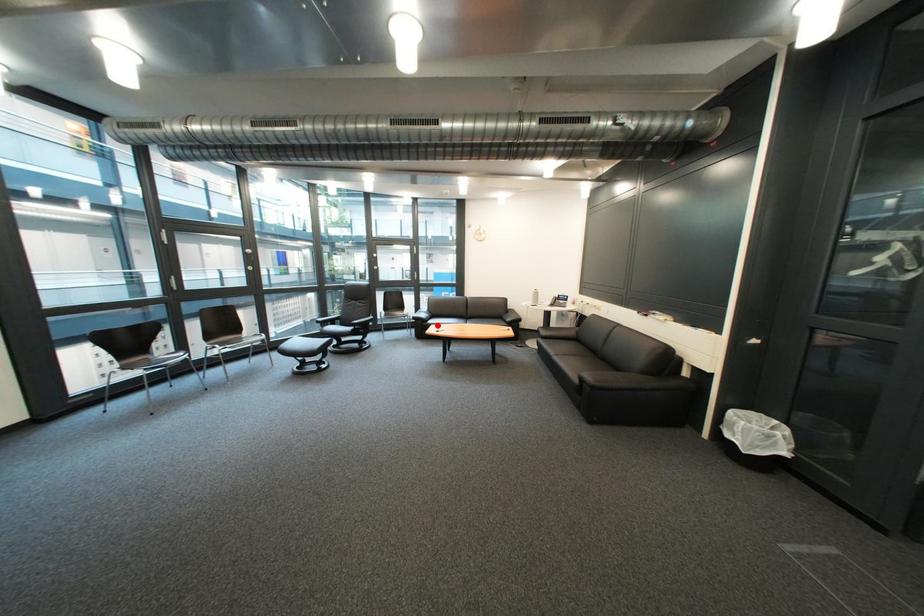
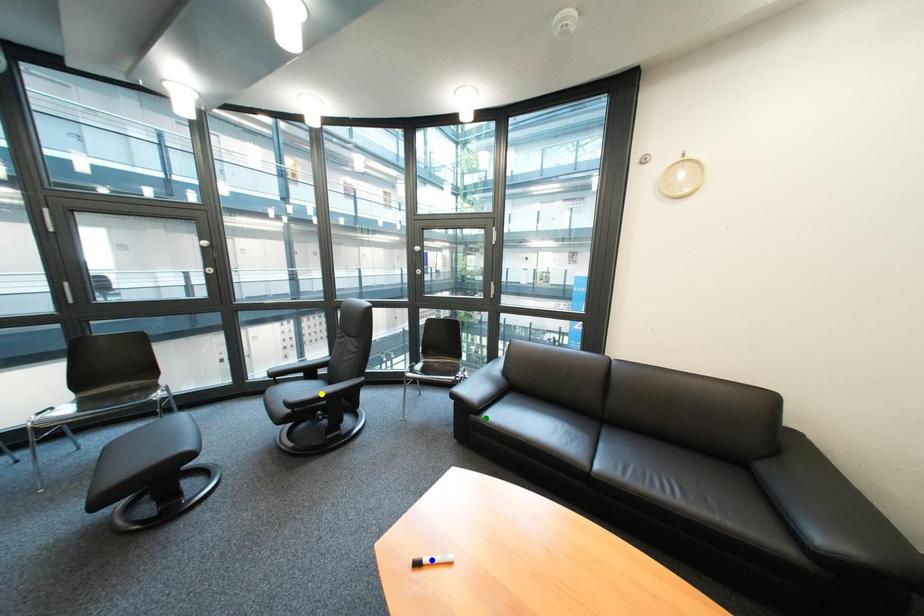
Question: I am providing you with two images of the same scene from different viewpoints. A red point is marked on the first image. You are given multiple points on the second image. Which mark in image 2 goes with the point in image 1?

Choices:
 (A) yellow point
 (B) green point
 (C) blue point

Answer: (B)